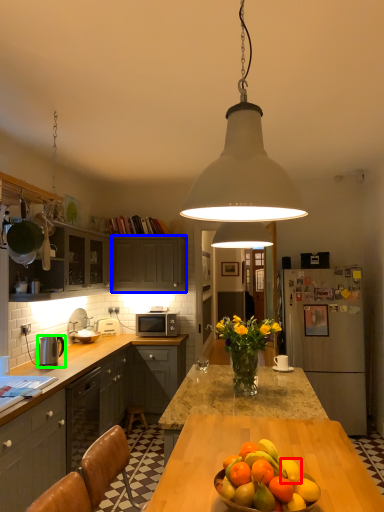
Question: Which is nearer to the citrus fruit (highlighted by a red box)? cabinetry (highlighted by a blue box) or appliance (highlighted by a green box).

Choices:
 (A) cabinetry
 (B) appliance

Answer: (B)